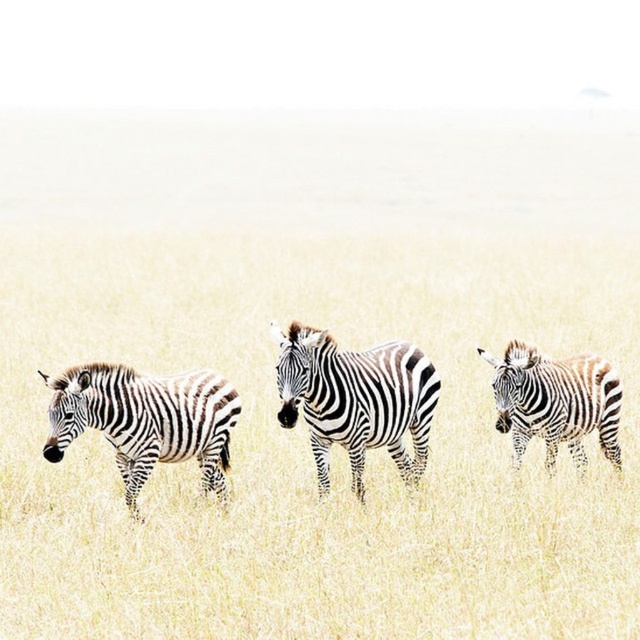
Question: Can you confirm if black and white striped zebra at left is smaller than black and white striped zebra at right?

Choices:
 (A) yes
 (B) no

Answer: (B)

Question: Which object appears closest to the camera in this image?

Choices:
 (A) black and white striped zebras at center
 (B) white grassland at center

Answer: (B)

Question: Considering the relative positions of black and white striped zebras at center and black and white striped zebra at right in the image provided, where is black and white striped zebras at center located with respect to black and white striped zebra at right?

Choices:
 (A) above
 (B) below

Answer: (A)

Question: Is white grassland at center to the left of black and white striped zebra at center from the viewer's perspective?

Choices:
 (A) yes
 (B) no

Answer: (B)

Question: Among these objects, which one is farthest from the camera?

Choices:
 (A) black and white striped zebra at right
 (B) white grassland at center
 (C) black and white striped zebra at center

Answer: (A)

Question: Which point appears farthest from the camera in this image?

Choices:
 (A) (579, 394)
 (B) (65, 628)
 (C) (276, 413)
 (D) (221, 397)

Answer: (C)